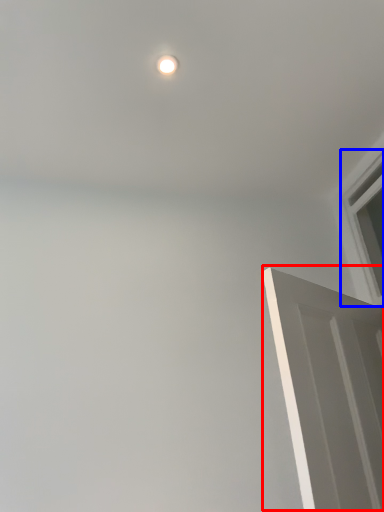
Question: Which object is closer to the camera taking this photo, door (highlighted by a red box) or window (highlighted by a blue box)?

Choices:
 (A) door
 (B) window

Answer: (A)